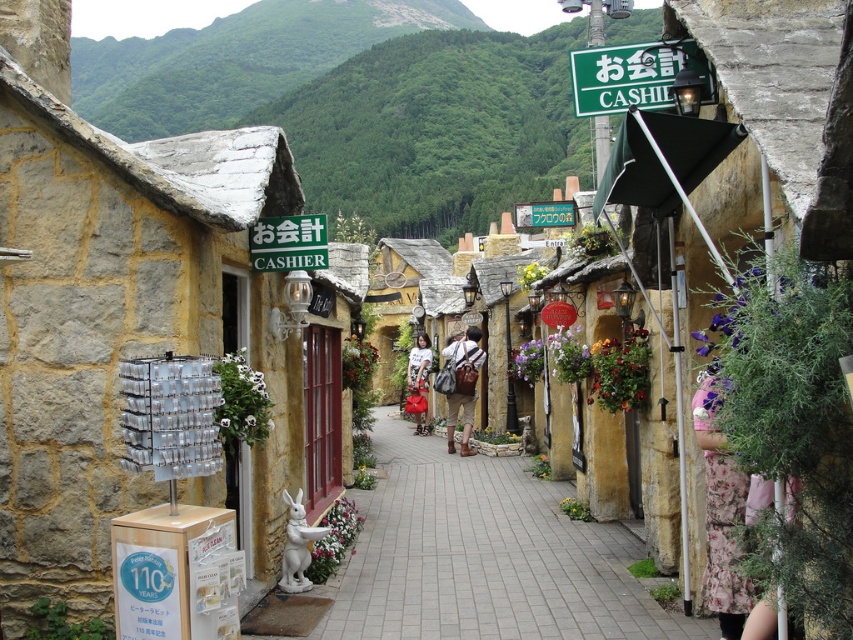
You are standing on the street and want to take a photo of the green grassy hillside at upper center. According to the scene description, where should you position yourself to ensure the hillside is in the upper part of your photo?

The green grassy hillside at upper center is located at point (399, 124) in the image coordinates, so you should position yourself to frame the photo such that the hillside appears in the upper portion of the image, likely by aiming the camera upwards or positioning yourself lower on the street to capture it in the upper section.